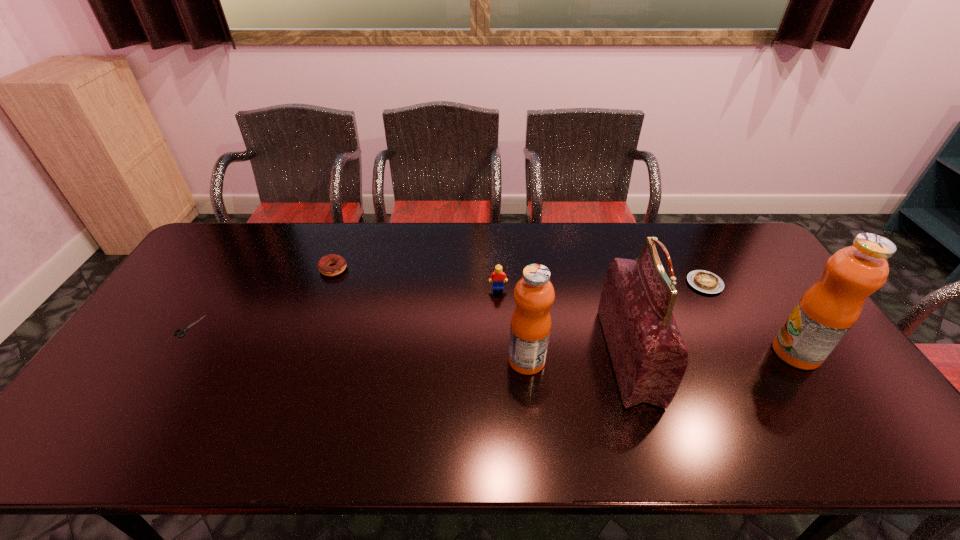
Locate which object is the sixth closest to the handbag. Please provide its 2D coordinates. Your answer should be formatted as a tuple, i.e. [(x, y)], where the tuple contains the x and y coordinates of a point satisfying the conditions above.

[(183, 330)]

I want to click on vacant area that satisfies the following two spatial constraints: 1. on the front-facing side of the handbag; 2. on the front side of the left fruit juice, so pyautogui.click(x=630, y=360).

The height and width of the screenshot is (540, 960). I want to click on free point that satisfies the following two spatial constraints: 1. on the front side of the sixth object from left to right; 2. on the left side of the second object from left to right, so click(327, 284).

Find the location of a particular element. free point that satisfies the following two spatial constraints: 1. on the front side of the rightmost object; 2. on the left side of the sixth tallest object is located at coordinates (743, 353).

Image resolution: width=960 pixels, height=540 pixels. What are the coordinates of `free location that satisfies the following two spatial constraints: 1. on the front side of the fifth tallest object; 2. on the left side of the fifth shortest object` in the screenshot? It's located at (299, 360).

What are the coordinates of `vacant space that satisfies the following two spatial constraints: 1. on the face of the taller fruit juice; 2. on the right side of the fourth tallest object` in the screenshot? It's located at (501, 353).